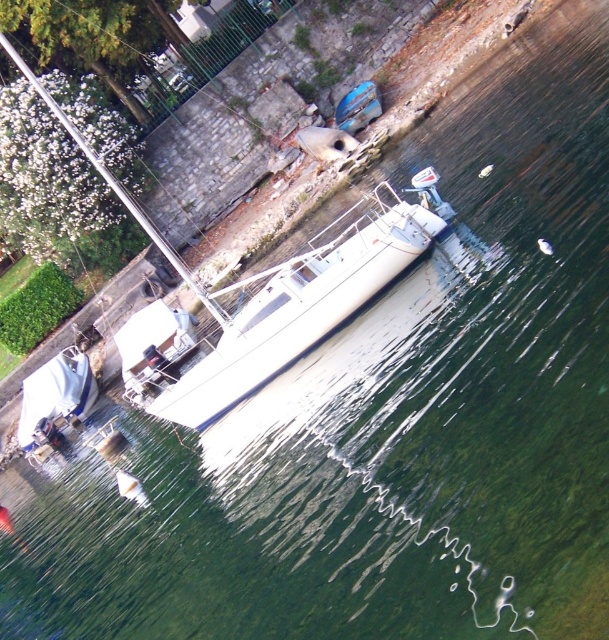
Between white glossy boat at center and blue glossy surfboard at upper center, which one has more height?

white glossy boat at center

Where is `white glossy boat at center`? Image resolution: width=609 pixels, height=640 pixels. white glossy boat at center is located at coordinates (289, 312).

Measure the distance between point [74,372] and camera.

Point [74,372] is 30.30 meters from camera.

Where is `white glossy boat at lower left`? white glossy boat at lower left is located at coordinates (57, 396).

Where is `white glossy boat at lower left`? The height and width of the screenshot is (640, 609). white glossy boat at lower left is located at coordinates (57, 396).

Between white glossy boat at center and white glossy boat at lower left, which one is positioned lower?

white glossy boat at lower left is below.

Who is more distant from viewer, (216,401) or (38,400)?

The point (38,400) is more distant.

Locate an element on the screen. white glossy boat at center is located at coordinates (289, 312).